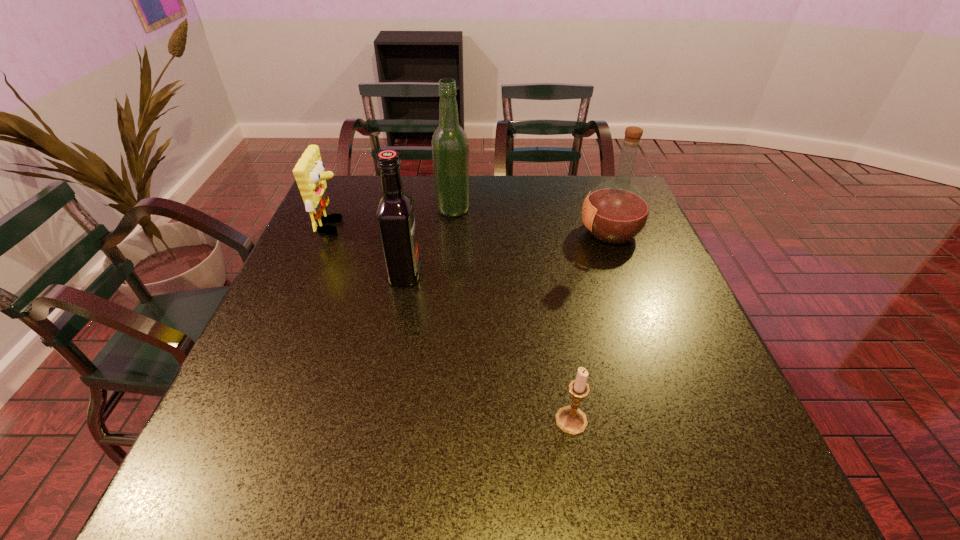
You are a GUI agent. You are given a task and a screenshot of the screen. Output one action in this format:
    pyautogui.click(x=<x>, y=<y>)
    Task: Click on the free spot between the rightmost liquor and the fourth farthest object
    The width and height of the screenshot is (960, 540).
    Given the screenshot: What is the action you would take?
    pyautogui.click(x=508, y=253)

You are a GUI agent. You are given a task and a screenshot of the screen. Output one action in this format:
    pyautogui.click(x=<x>, y=<y>)
    Task: Click on the vacant point located between the shortest object and the sponge
    The width and height of the screenshot is (960, 540).
    Given the screenshot: What is the action you would take?
    pyautogui.click(x=452, y=323)

This screenshot has width=960, height=540. What are the coordinates of `vacant region between the shortest object and the nearest liquor` in the screenshot? It's located at (488, 347).

The width and height of the screenshot is (960, 540). Identify the location of free area in between the leftmost liquor and the second object from right to left. (488, 347).

The height and width of the screenshot is (540, 960). I want to click on free spot between the rightmost object and the leftmost liquor, so click(508, 253).

Where is `unoccupied area between the second liquor from left to right and the nearest object`? unoccupied area between the second liquor from left to right and the nearest object is located at coordinates (512, 315).

Identify the location of free area in between the second liquor from left to right and the nearest liquor. The image size is (960, 540). (429, 241).

Select which object appears as the closest to the third object from right to left. Please provide its 2D coordinates. Your answer should be formatted as a tuple, i.e. [(x, y)], where the tuple contains the x and y coordinates of a point satisfying the conditions above.

[(395, 214)]

The width and height of the screenshot is (960, 540). I want to click on the second closest object to the nearest liquor, so click(450, 148).

The image size is (960, 540). I want to click on the second closest liquor to the rightmost liquor, so click(395, 214).